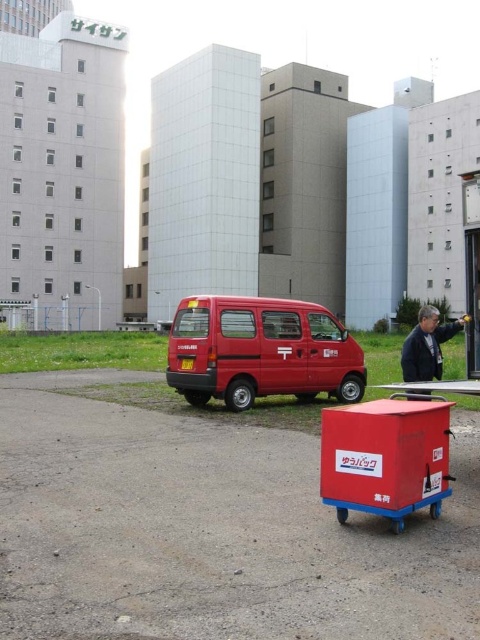
Does point (259, 380) come farther from viewer compared to point (408, 371)?

Yes.

Who is higher up, matte red van at center or black leather jacket at lower right?

Positioned higher is black leather jacket at lower right.

The image size is (480, 640). In order to click on matte red van at center in this screenshot , I will do `click(261, 352)`.

Locate an element on the screen. The image size is (480, 640). matte red van at center is located at coordinates (261, 352).

Is matte red van at center behind matte red cart at center?

Yes, it is.

Is matte red van at center positioned before matte red cart at center?

No, matte red van at center is further to the viewer.

You are a GUI agent. You are given a task and a screenshot of the screen. Output one action in this format:
    pyautogui.click(x=<x>, y=<y>)
    Task: Click on the matte red van at center
    The height and width of the screenshot is (640, 480).
    Given the screenshot: What is the action you would take?
    pyautogui.click(x=261, y=352)

Where is `matte red van at center`? The width and height of the screenshot is (480, 640). matte red van at center is located at coordinates (261, 352).

Is black leather jacket at lower right above matte red cart at center?

Correct, black leather jacket at lower right is located above matte red cart at center.

Does point (427, 372) lie behind point (467, 387)?

That is True.

This screenshot has width=480, height=640. Find the location of `black leather jacket at lower right`. black leather jacket at lower right is located at coordinates (427, 346).